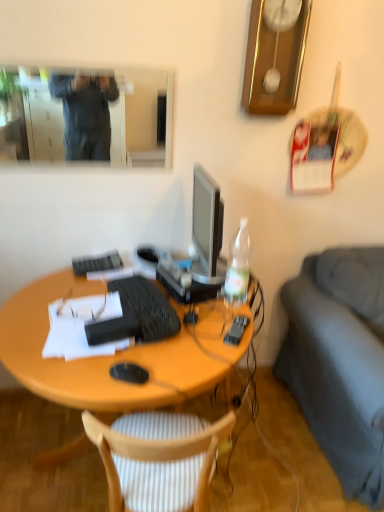
This screenshot has height=512, width=384. Identify the location of vacant space behind matte black glasses at center. [91, 286].